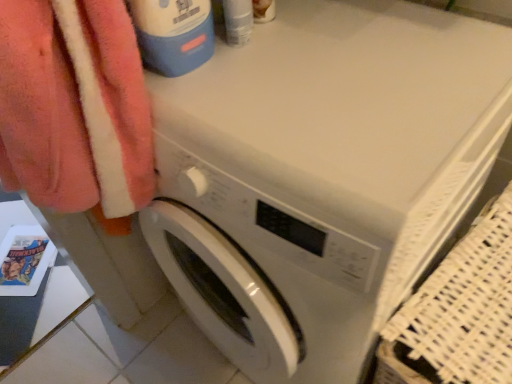
Question: Considering the positions of point (199, 8) and point (335, 175), is point (199, 8) closer or farther from the camera than point (335, 175)?

Choices:
 (A) closer
 (B) farther

Answer: (B)

Question: Is blue plastic bottle at upper left wider or thinner than white glossy washing machine at center?

Choices:
 (A) wide
 (B) thin

Answer: (B)

Question: Is blue plastic bottle at upper left spatially inside white glossy washing machine at center, or outside of it?

Choices:
 (A) outside
 (B) inside

Answer: (A)

Question: In the image, is white glossy washing machine at center on the left side or the right side of blue plastic bottle at upper left?

Choices:
 (A) right
 (B) left

Answer: (A)

Question: From a real-world perspective, is white glossy washing machine at center physically located above or below blue plastic bottle at upper left?

Choices:
 (A) below
 (B) above

Answer: (A)

Question: Is white glossy washing machine at center spatially inside blue plastic bottle at upper left, or outside of it?

Choices:
 (A) inside
 (B) outside

Answer: (B)

Question: Relative to blue plastic bottle at upper left, is white glossy washing machine at center in front or behind?

Choices:
 (A) behind
 (B) front

Answer: (B)